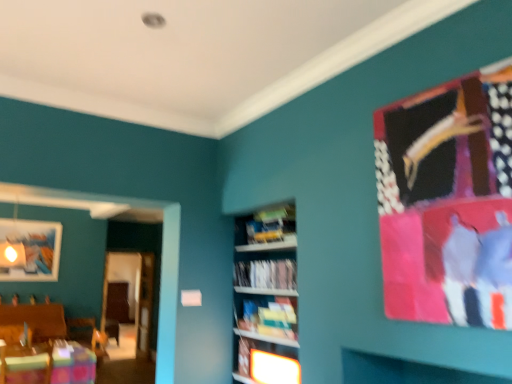
What do you see at coordinates (269, 317) in the screenshot?
I see `yellow paperback book at center, placed as the 1th book when sorted from bottom to top` at bounding box center [269, 317].

Image resolution: width=512 pixels, height=384 pixels. In order to click on matte white shelf at center in this screenshot , I will do `click(268, 362)`.

Where is `yellow paperback book at center, placed as the 1th book when sorted from bottom to top`? This screenshot has width=512, height=384. yellow paperback book at center, placed as the 1th book when sorted from bottom to top is located at coordinates (269, 317).

Could you tell me if white paper at center, the 1th book positioned from the top, is facing matte white shelf at center?

No, white paper at center, the 1th book positioned from the top, does not turn towards matte white shelf at center.

From the image's perspective, is white paper at center, the second book positioned from the bottom, on top of matte white shelf at center?

Indeed, from the image's perspective, white paper at center, the second book positioned from the bottom, is shown above matte white shelf at center.

How different are the orientations of white paper at center, the second book positioned from the bottom, and matte white shelf at center in degrees?

white paper at center, the second book positioned from the bottom, and matte white shelf at center are facing 0.0039 degrees away from each other.

Is point (288, 263) more distant than point (23, 361)?

No, it is not.

Is there a large distance between white paper at center, the 1th book positioned from the top, and wooden table at lower left?

Yes, white paper at center, the 1th book positioned from the top, is far from wooden table at lower left.

Who is shorter, white paper at center, the second book positioned from the bottom, or wooden table at lower left?

white paper at center, the second book positioned from the bottom.

Which object is closer to the camera, white paper at center, the second book positioned from the bottom, or wooden table at lower left?

Positioned in front is white paper at center, the second book positioned from the bottom.

How many degrees apart are the facing directions of wooden table at lower left and yellow paperback book at center, placed as the 1th book when sorted from bottom to top?

The angle between the facing direction of wooden table at lower left and the facing direction of yellow paperback book at center, placed as the 1th book when sorted from bottom to top, is 84.4 degrees.

How far apart are wooden table at lower left and yellow paperback book at center, placed as the 1th book when sorted from bottom to top?

wooden table at lower left and yellow paperback book at center, placed as the 1th book when sorted from bottom to top, are 6.55 feet apart.

Is wooden table at lower left facing away from yellow paperback book at center, which appears as the second book when viewed from the top?

No, yellow paperback book at center, which appears as the second book when viewed from the top, is not at the back of wooden table at lower left.

Based on their sizes in the image, would you say wooden table at lower left is bigger or smaller than yellow paperback book at center, placed as the 1th book when sorted from bottom to top?

Considering their sizes, wooden table at lower left takes up more space than yellow paperback book at center, placed as the 1th book when sorted from bottom to top.

Between matte wooden picture frame at upper left and yellow paperback book at center, which appears as the second book when viewed from the top, which one has larger size?

With larger size is matte wooden picture frame at upper left.

Is matte wooden picture frame at upper left not within yellow paperback book at center, placed as the 1th book when sorted from bottom to top?

Yes, matte wooden picture frame at upper left is located beyond the bounds of yellow paperback book at center, placed as the 1th book when sorted from bottom to top.

The width and height of the screenshot is (512, 384). Identify the location of picture frame located above the yellow paperback book at center, placed as the 1th book when sorted from bottom to top (from a real-world perspective). (29, 250).

Considering the sizes of matte wooden picture frame at upper left and yellow paperback book at center, which appears as the second book when viewed from the top, in the image, is matte wooden picture frame at upper left taller or shorter than yellow paperback book at center, which appears as the second book when viewed from the top,?

In the image, matte wooden picture frame at upper left appears to be taller than yellow paperback book at center, which appears as the second book when viewed from the top.

From a real-world perspective, is wooden table at lower left positioned over matte wooden picture frame at upper left based on gravity?

Incorrect, from a real-world perspective, wooden table at lower left is lower than matte wooden picture frame at upper left.

From the image's perspective, would you say wooden table at lower left is shown under matte wooden picture frame at upper left?

Indeed, from the image's perspective, wooden table at lower left is shown beneath matte wooden picture frame at upper left.

Does wooden table at lower left come in front of matte wooden picture frame at upper left?

Yes, the depth of wooden table at lower left is less than that of matte wooden picture frame at upper left.

Does wooden table at lower left turn towards matte wooden picture frame at upper left?

Yes, wooden table at lower left is oriented towards matte wooden picture frame at upper left.

Based on the photo, is matte white shelf at center placed right next to white paper at center, the 1th book positioned from the top?

matte white shelf at center and white paper at center, the 1th book positioned from the top, are clearly separated.

Is matte white shelf at center thinner than white paper at center, the second book positioned from the bottom?

Yes.

Is matte white shelf at center located outside white paper at center, the second book positioned from the bottom?

Yes.

From their relative heights in the image, would you say matte wooden picture frame at upper left is taller or shorter than wooden table at lower left?

Clearly, matte wooden picture frame at upper left is taller compared to wooden table at lower left.

Relative to wooden table at lower left, is matte wooden picture frame at upper left in front or behind?

Clearly, matte wooden picture frame at upper left is behind wooden table at lower left.

In order to click on picture frame above the wooden table at lower left (from the image's perspective) in this screenshot , I will do `click(29, 250)`.

Can wooden table at lower left be found inside matte wooden picture frame at upper left?

No.

This screenshot has width=512, height=384. What are the coordinates of `shelf below the white paper at center, the second book positioned from the bottom (from the image's perspective)` in the screenshot? It's located at (268, 362).

The width and height of the screenshot is (512, 384). Identify the location of the 2nd book in front when counting from the wooden table at lower left. (266, 274).

Estimate the real-world distances between objects in this image. Which object is further from wooden table at lower left, yellow paperback book at center, which appears as the second book when viewed from the top, or matte white shelf at center?

yellow paperback book at center, which appears as the second book when viewed from the top, is further to wooden table at lower left.

From the image, which object appears to be farther from matte white shelf at center, yellow paperback book at center, placed as the 1th book when sorted from bottom to top, or white paper at center, the 1th book positioned from the top?

white paper at center, the 1th book positioned from the top, is further to matte white shelf at center.

Based on their spatial positions, is yellow paperback book at center, placed as the 1th book when sorted from bottom to top, or white paper at center, the second book positioned from the bottom, further from matte wooden picture frame at upper left?

yellow paperback book at center, placed as the 1th book when sorted from bottom to top.

Based on their spatial positions, is matte white shelf at center or yellow paperback book at center, which appears as the second book when viewed from the top, closer to matte wooden picture frame at upper left?

Based on the image, yellow paperback book at center, which appears as the second book when viewed from the top, appears to be nearer to matte wooden picture frame at upper left.

Considering their positions, is wooden table at lower left positioned further to white paper at center, the 1th book positioned from the top, than matte white shelf at center?

wooden table at lower left is positioned further to the anchor white paper at center, the 1th book positioned from the top.

Considering their positions, is matte wooden picture frame at upper left positioned further to yellow paperback book at center, which appears as the second book when viewed from the top, than matte white shelf at center?

Based on the image, matte wooden picture frame at upper left appears to be further to yellow paperback book at center, which appears as the second book when viewed from the top.

When comparing their distances from matte wooden picture frame at upper left, does white paper at center, the 1th book positioned from the top, or yellow paperback book at center, placed as the 1th book when sorted from bottom to top, seem closer?

white paper at center, the 1th book positioned from the top, lies closer to matte wooden picture frame at upper left than the other object.

From the image, which object appears to be nearer to yellow paperback book at center, placed as the 1th book when sorted from bottom to top, wooden table at lower left or matte white shelf at center?

Among the two, matte white shelf at center is located nearer to yellow paperback book at center, placed as the 1th book when sorted from bottom to top.

The image size is (512, 384). Identify the location of shelf situated between matte wooden picture frame at upper left and white paper at center, the 1th book positioned from the top, from left to right. (268, 362).

Locate an element on the screen. This screenshot has height=384, width=512. table located between matte wooden picture frame at upper left and white paper at center, the 1th book positioned from the top, in the left-right direction is located at coordinates point(53,366).

What are the coordinates of `shelf situated between matte wooden picture frame at upper left and yellow paperback book at center, placed as the 1th book when sorted from bottom to top, from left to right` in the screenshot? It's located at (268, 362).

This screenshot has height=384, width=512. I want to click on table situated between matte wooden picture frame at upper left and matte white shelf at center from left to right, so click(53, 366).